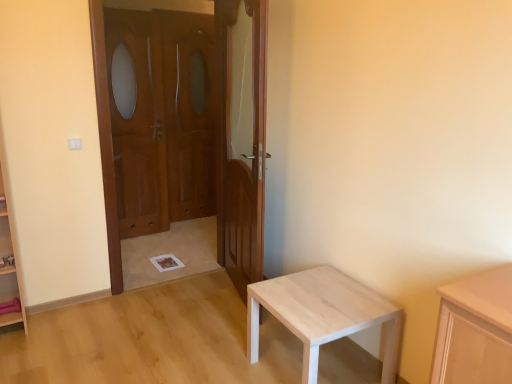
Question: Considering the relative positions of light wood table at lower right and wooden screen door at center, which is the second screen door from right to left, in the image provided, is light wood table at lower right to the left or to the right of wooden screen door at center, which is the second screen door from right to left,?

Choices:
 (A) right
 (B) left

Answer: (A)

Question: Is light wood table at lower right situated inside wooden screen door at center, the 1th screen door in the left-to-right sequence, or outside?

Choices:
 (A) inside
 (B) outside

Answer: (B)

Question: Based on their relative distances, which object is farther from the wooden screen door at center, the 1th screen door in the left-to-right sequence?

Choices:
 (A) wooden at center, which is the 1th door in right-to-left order
 (B) light wood table at lower right
 (C) wooden screen door at center, the 1th screen door in the right-to-left sequence
 (D) wooden door at left, which ranks as the first door in left-to-right order

Answer: (B)

Question: Estimate the real-world distances between objects in this image. Which object is farther from the light wood table at lower right?

Choices:
 (A) wooden at center, which is the 1th door in right-to-left order
 (B) wooden screen door at center, which is the second screen door from right to left
 (C) wooden screen door at center, the second screen door positioned from the left
 (D) wooden door at left, which ranks as the first door in left-to-right order

Answer: (C)